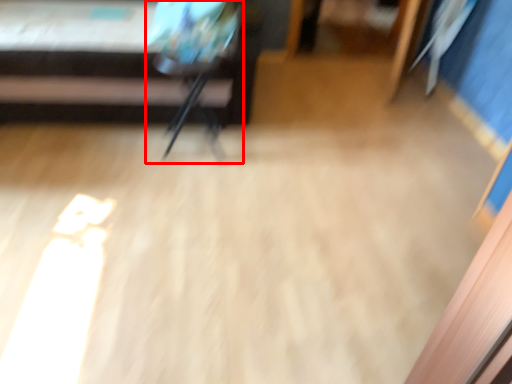
Question: From the image's perspective, what is the correct spatial positioning of armchair (annotated by the red box) in reference to furniture?

Choices:
 (A) above
 (B) below

Answer: (B)